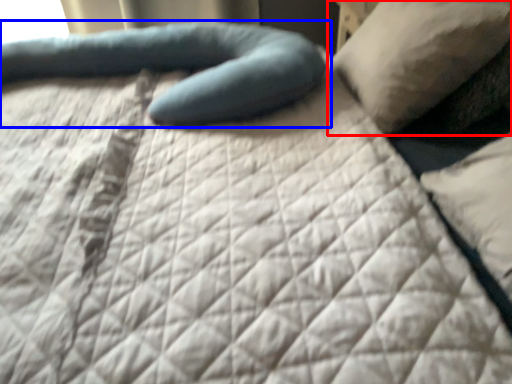
Question: Which object is closer to the camera taking this photo, pillow (highlighted by a red box) or pillow (highlighted by a blue box)?

Choices:
 (A) pillow
 (B) pillow

Answer: (A)